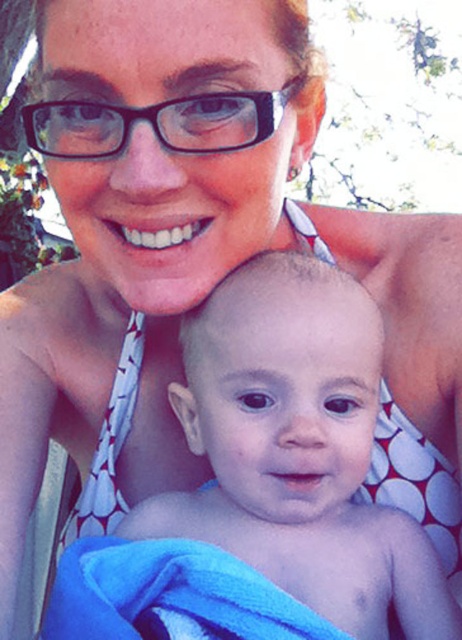
You are a photographer setting up for a family photo. You have a camera with a lens that can focus on objects within a 30 cm width. You notice the smooth skin baby at center and the black plastic glasses at upper center in the scene. Which object might require a wider focus setting to capture fully?

The smooth skin baby at center might be wider than the black plastic glasses at upper center, so the photographer should adjust the focus to accommodate the wider width of the smooth skin baby at center.

You are a photographer setting up for a photoshoot. You have a smooth skin baby at center and a white dotted fabric bikini top at center in your frame. Which object should you focus on if you want to capture the larger subject?

The smooth skin baby at center is bigger than the white dotted fabric bikini top at center, so you should focus on the smooth skin baby at center to capture the larger subject.